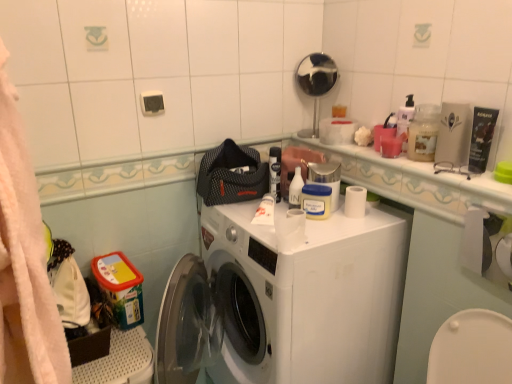
Find the location of `translucent plastic container at upper right`. translucent plastic container at upper right is located at coordinates (423, 132).

What do you see at coordinates (383, 132) in the screenshot? This screenshot has width=512, height=384. I see `translucent plastic cup at upper right, which is the third toiletry from right to left` at bounding box center [383, 132].

Find the location of a particular element. This screenshot has height=384, width=512. translucent plastic cup at upper right, which is the third toiletry from right to left is located at coordinates (383, 132).

This screenshot has width=512, height=384. Describe the element at coordinates (416, 182) in the screenshot. I see `white glossy counter top at upper right` at that location.

Where is `white glossy counter top at upper right`? white glossy counter top at upper right is located at coordinates (416, 182).

Image resolution: width=512 pixels, height=384 pixels. Describe the element at coordinates (316, 201) in the screenshot. I see `yellow matte jar at center, the second toiletry viewed from the left` at that location.

This screenshot has height=384, width=512. What do you see at coordinates (392, 146) in the screenshot?
I see `pink matte candle at upper right, the fourth toiletry when ordered from left to right` at bounding box center [392, 146].

You are a GUI agent. You are given a task and a screenshot of the screen. Output one action in this format:
    pyautogui.click(x=<x>, y=<y>)
    Task: Click on the translucent plastic container at upper right
    
    Given the screenshot: What is the action you would take?
    pyautogui.click(x=423, y=132)

Between white plastic washing machine at center and polished chrome mirror at upper center, which one has less height?

polished chrome mirror at upper center is shorter.

Which is closer to the camera, (214, 241) or (302, 134)?

Point (214, 241)

Which object is further away from the camera, white plastic washing machine at center or polished chrome mirror at upper center?

polished chrome mirror at upper center is behind.

Is white plastic washing machine at center next to polished chrome mirror at upper center?

No, white plastic washing machine at center is not making contact with polished chrome mirror at upper center.

Can you confirm if polished chrome mirror at upper center is smaller than white glossy counter top at upper right?

No, polished chrome mirror at upper center is not smaller than white glossy counter top at upper right.

Which is more to the right, polished chrome mirror at upper center or white glossy counter top at upper right?

white glossy counter top at upper right is more to the right.

Is polished chrome mirror at upper center not within white glossy counter top at upper right?

Yes, polished chrome mirror at upper center is located beyond the bounds of white glossy counter top at upper right.

Consider the image. Between polished chrome mirror at upper center and white glossy counter top at upper right, which one has more height?

Standing taller between the two is polished chrome mirror at upper center.

Can you tell me how much pink matte candle at upper right, the second toiletry when ordered from right to left, and yellow matte jar at center, the second toiletry viewed from the left, differ in facing direction?

41.7 degrees separate the facing orientations of pink matte candle at upper right, the second toiletry when ordered from right to left, and yellow matte jar at center, the second toiletry viewed from the left.

Which is more to the left, pink matte candle at upper right, the second toiletry when ordered from right to left, or yellow matte jar at center, the second toiletry viewed from the left?

yellow matte jar at center, the second toiletry viewed from the left, is more to the left.

Is pink matte candle at upper right, the second toiletry when ordered from right to left, far away from yellow matte jar at center, which is counted as the 4th toiletry, starting from the right?

pink matte candle at upper right, the second toiletry when ordered from right to left, is actually quite close to yellow matte jar at center, which is counted as the 4th toiletry, starting from the right.

Would you say pink matte candle at upper right, the second toiletry when ordered from right to left, is inside or outside yellow matte jar at center, the second toiletry viewed from the left?

pink matte candle at upper right, the second toiletry when ordered from right to left, cannot be found inside yellow matte jar at center, the second toiletry viewed from the left.

Can you tell me how much white plastic bottle at upper center, arranged as the 5th toiletry when viewed from the right, and yellow matte jar at center, which is counted as the 4th toiletry, starting from the right, differ in facing direction?

The facing directions of white plastic bottle at upper center, arranged as the 5th toiletry when viewed from the right, and yellow matte jar at center, which is counted as the 4th toiletry, starting from the right, are 4.19e-05 degrees apart.

Is white plastic bottle at upper center, which ranks as the first toiletry in left-to-right order, oriented away from yellow matte jar at center, which is counted as the 4th toiletry, starting from the right?

That's not correct — white plastic bottle at upper center, which ranks as the first toiletry in left-to-right order, is not looking away from yellow matte jar at center, which is counted as the 4th toiletry, starting from the right.

Based on the photo, which point is more distant from viewer, (298, 183) or (328, 198)?

The point (298, 183) is farther from the camera.

In the scene shown: Considering the positions of objects white plastic bottle at upper center, arranged as the 5th toiletry when viewed from the right, and yellow matte jar at center, the second toiletry viewed from the left, in the image provided, who is more to the left, white plastic bottle at upper center, arranged as the 5th toiletry when viewed from the right, or yellow matte jar at center, the second toiletry viewed from the left,?

Positioned to the left is white plastic bottle at upper center, arranged as the 5th toiletry when viewed from the right.

Does yellow matte jar at center, the second toiletry viewed from the left, have a greater width compared to white plastic washing machine at center?

Incorrect, the width of yellow matte jar at center, the second toiletry viewed from the left, does not surpass that of white plastic washing machine at center.

Is the position of yellow matte jar at center, which is counted as the 4th toiletry, starting from the right, more distant than that of white plastic washing machine at center?

Yes, the depth of yellow matte jar at center, which is counted as the 4th toiletry, starting from the right, is greater than that of white plastic washing machine at center.

Is yellow matte jar at center, the second toiletry viewed from the left, at the left side of white plastic washing machine at center?

No.

Can you tell me how much yellow matte jar at center, the second toiletry viewed from the left, and white plastic washing machine at center differ in facing direction?

There is a 40.9-degree angle between the facing directions of yellow matte jar at center, the second toiletry viewed from the left, and white plastic washing machine at center.

In the image, is translucent plastic container at upper right on the left side or the right side of white glossy counter top at upper right?

translucent plastic container at upper right is positioned on white glossy counter top at upper right's right side.

Is translucent plastic container at upper right taller or shorter than white glossy counter top at upper right?

In the image, translucent plastic container at upper right appears to be taller than white glossy counter top at upper right.

From a real-world perspective, which object rests below the other?

white glossy counter top at upper right is physically lower.

Does point (486, 149) appear closer or farther from the camera than point (339, 302)?

Point (486, 149) is closer to the camera than point (339, 302).

Is matte black tube at upper right, placed as the fifth toiletry when sorted from left to right, situated inside white plastic washing machine at center or outside?

matte black tube at upper right, placed as the fifth toiletry when sorted from left to right, is spatially situated outside white plastic washing machine at center.

Considering the positions of objects matte black tube at upper right, marked as the first toiletry in a right-to-left arrangement, and white plastic washing machine at center in the image provided, who is more to the left, matte black tube at upper right, marked as the first toiletry in a right-to-left arrangement, or white plastic washing machine at center?

From the viewer's perspective, white plastic washing machine at center appears more on the left side.

Between matte black tube at upper right, marked as the first toiletry in a right-to-left arrangement, and white plastic washing machine at center, which one has less height?

matte black tube at upper right, marked as the first toiletry in a right-to-left arrangement.

Image resolution: width=512 pixels, height=384 pixels. Identify the location of washing machine on the left of the polished chrome mirror at upper center. (286, 301).

This screenshot has height=384, width=512. I want to click on counter top that appears below the polished chrome mirror at upper center (from a real-world perspective), so click(416, 182).

Looking at this image, which object lies further to the anchor point translucent plastic container at upper right, matte black tube at upper right, marked as the first toiletry in a right-to-left arrangement, or white plastic bottle at upper center, arranged as the 5th toiletry when viewed from the right?

The object further to translucent plastic container at upper right is white plastic bottle at upper center, arranged as the 5th toiletry when viewed from the right.

When comparing their distances from white plastic bottle at upper center, which ranks as the first toiletry in left-to-right order, does pink matte candle at upper right, the second toiletry when ordered from right to left, or white glossy counter top at upper right seem closer?

pink matte candle at upper right, the second toiletry when ordered from right to left, lies closer to white plastic bottle at upper center, which ranks as the first toiletry in left-to-right order, than the other object.

Based on their spatial positions, is polished chrome mirror at upper center or pink matte candle at upper right, the second toiletry when ordered from right to left, closer to yellow matte jar at center, the second toiletry viewed from the left?

pink matte candle at upper right, the second toiletry when ordered from right to left, is closer to yellow matte jar at center, the second toiletry viewed from the left.

Looking at the image, which one is located further to polished chrome mirror at upper center, white plastic bottle at upper center, which ranks as the first toiletry in left-to-right order, or translucent plastic cup at upper right, marked as the 3th toiletry in a left-to-right arrangement?

white plastic bottle at upper center, which ranks as the first toiletry in left-to-right order, lies further to polished chrome mirror at upper center than the other object.

From the image, which object appears to be farther from translucent plastic cup at upper right, which is the third toiletry from right to left, white glossy counter top at upper right or matte black tube at upper right, placed as the fifth toiletry when sorted from left to right?

The object further to translucent plastic cup at upper right, which is the third toiletry from right to left, is matte black tube at upper right, placed as the fifth toiletry when sorted from left to right.

From the image, which object appears to be nearer to white plastic bottle at upper center, arranged as the 5th toiletry when viewed from the right, white plastic washing machine at center or yellow matte jar at center, which is counted as the 4th toiletry, starting from the right?

yellow matte jar at center, which is counted as the 4th toiletry, starting from the right, is positioned closer to the anchor white plastic bottle at upper center, arranged as the 5th toiletry when viewed from the right.

Estimate the real-world distances between objects in this image. Which object is further from matte black tube at upper right, marked as the first toiletry in a right-to-left arrangement, yellow matte jar at center, the second toiletry viewed from the left, or white plastic bottle at upper center, which ranks as the first toiletry in left-to-right order?

Among the two, white plastic bottle at upper center, which ranks as the first toiletry in left-to-right order, is located further to matte black tube at upper right, marked as the first toiletry in a right-to-left arrangement.

Looking at the image, which one is located further to translucent plastic cup at upper right, which is the third toiletry from right to left, white plastic bottle at upper center, which ranks as the first toiletry in left-to-right order, or white plastic washing machine at center?

white plastic washing machine at center is further to translucent plastic cup at upper right, which is the third toiletry from right to left.

This screenshot has height=384, width=512. In order to click on shower located between white plastic bottle at upper center, which ranks as the first toiletry in left-to-right order, and translucent plastic container at upper right in the left-right direction in this screenshot , I will do `click(315, 84)`.

Identify the location of toiletry between white plastic bottle at upper center, which ranks as the first toiletry in left-to-right order, and translucent plastic cup at upper right, marked as the 3th toiletry in a left-to-right arrangement. The image size is (512, 384). (316, 201).

Locate an element on the screen. shower between yellow matte jar at center, which is counted as the 4th toiletry, starting from the right, and matte black tube at upper right, placed as the fifth toiletry when sorted from left to right, in the horizontal direction is located at coordinates (315, 84).

Locate an element on the screen. The width and height of the screenshot is (512, 384). cleaning product between white plastic bottle at upper center, arranged as the 5th toiletry when viewed from the right, and matte black tube at upper right, marked as the first toiletry in a right-to-left arrangement, from left to right is located at coordinates (423, 132).